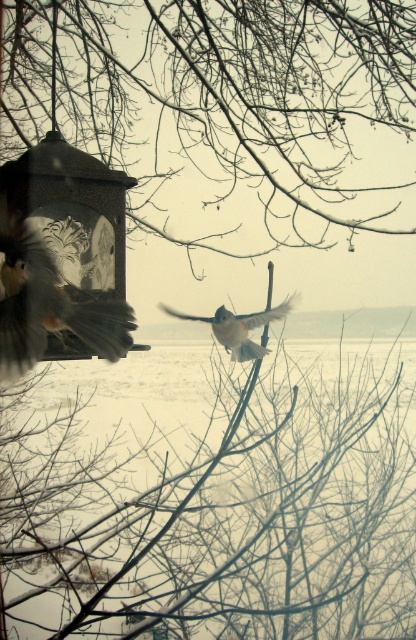
You are a photographer aiming to capture the blurred feathers bird at left in the winter scene. Based on its position coordinates, where should you focus your camera to ensure it is centered in the frame?

The blurred feathers bird at left is located at coordinates point (51, 308), so you should focus your camera at that point to center it in the frame.

You are a photographer trying to capture a clear shot of the smooth bark tree at center and the white fluffy bird at center. Which object should you focus on first to ensure it appears sharp in your photo?

You should focus on the smooth bark tree at center first because it is closer to you than the white fluffy bird at center, so focusing on the closer object ensures sharpness.